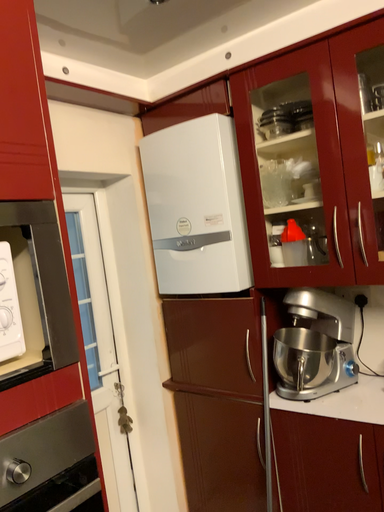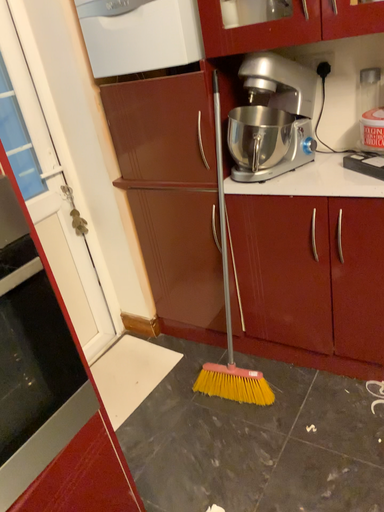
Question: How did the camera likely rotate when shooting the video?

Choices:
 (A) rotated upward
 (B) rotated downward

Answer: (B)